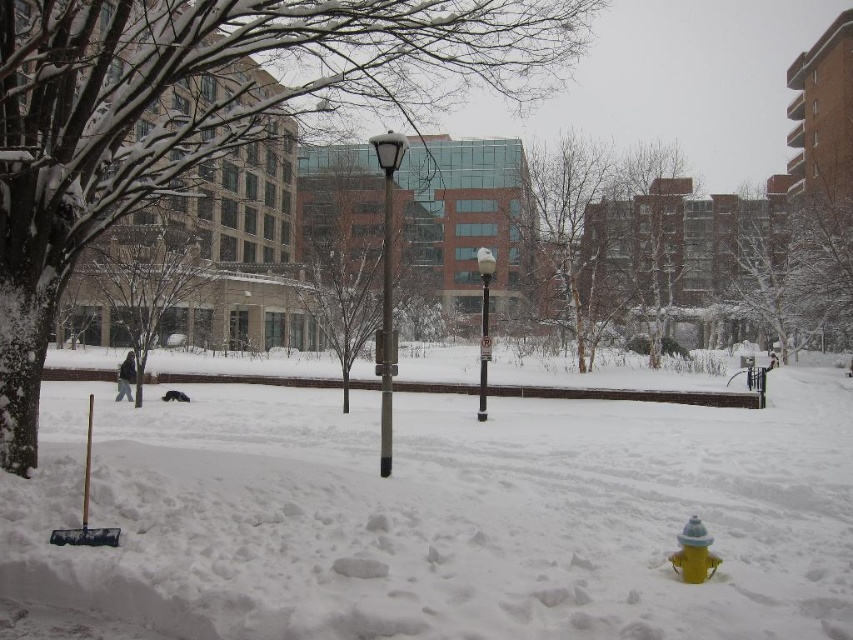
Looking at this image, you are a city planner assessing the park layout. Given the presence of both the satin black lamp post at center and the metallic gray pole at center, which one has a greater width?

The satin black lamp post at center has a greater width than the metallic gray pole at center.